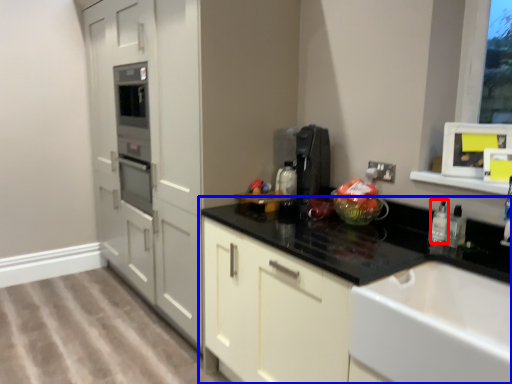
Question: Which object appears closest to the camera in this image, bottle (highlighted by a red box) or countertop (highlighted by a blue box)?

Choices:
 (A) bottle
 (B) countertop

Answer: (B)